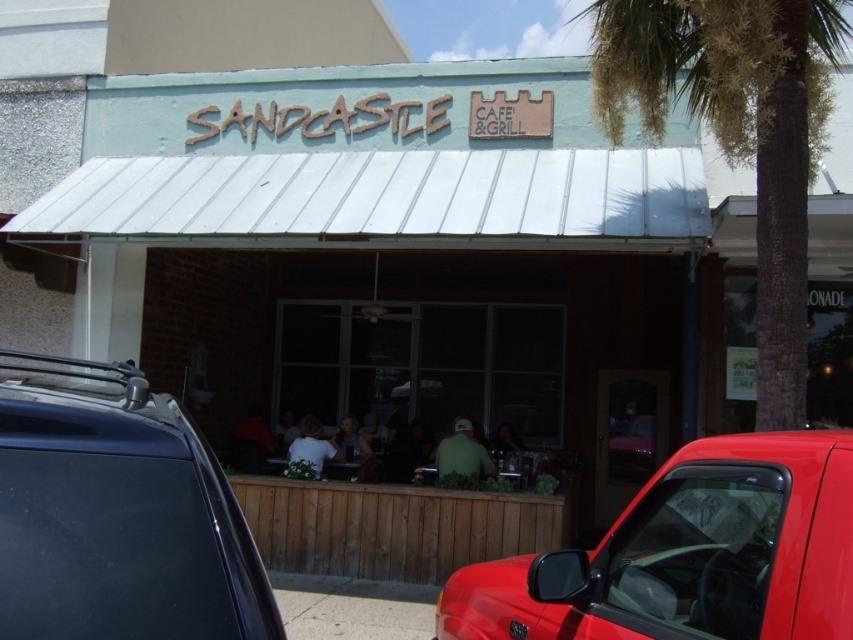
Is point (183, 595) closer to viewer compared to point (738, 4)?

Yes.

Looking at this image, is the position of matte black car at center less distant than that of green leafy palm tree at upper right?

That is True.

You are a GUI agent. You are given a task and a screenshot of the screen. Output one action in this format:
    pyautogui.click(x=<x>, y=<y>)
    Task: Click on the matte black car at center
    The image size is (853, 640).
    Given the screenshot: What is the action you would take?
    pyautogui.click(x=119, y=516)

Identify the location of matte black car at center. (119, 516).

The image size is (853, 640). What do you see at coordinates (689, 554) in the screenshot? I see `shiny red truck at lower right` at bounding box center [689, 554].

Is shiny red truck at lower right behind green leafy palm tree at upper right?

No, it is in front of green leafy palm tree at upper right.

Which is behind, point (640, 582) or point (820, 54)?

The point (820, 54) is more distant.

Where is `shiny red truck at lower right`? The image size is (853, 640). shiny red truck at lower right is located at coordinates (689, 554).

Can you confirm if matte black car at center is taller than shiny red truck at lower right?

Incorrect, matte black car at center's height is not larger of shiny red truck at lower right's.

Does matte black car at center appear on the right side of shiny red truck at lower right?

Incorrect, matte black car at center is not on the right side of shiny red truck at lower right.

Measure the distance between matte black car at center and camera.

1.29 meters

Where is `matte black car at center`? Image resolution: width=853 pixels, height=640 pixels. matte black car at center is located at coordinates (119, 516).